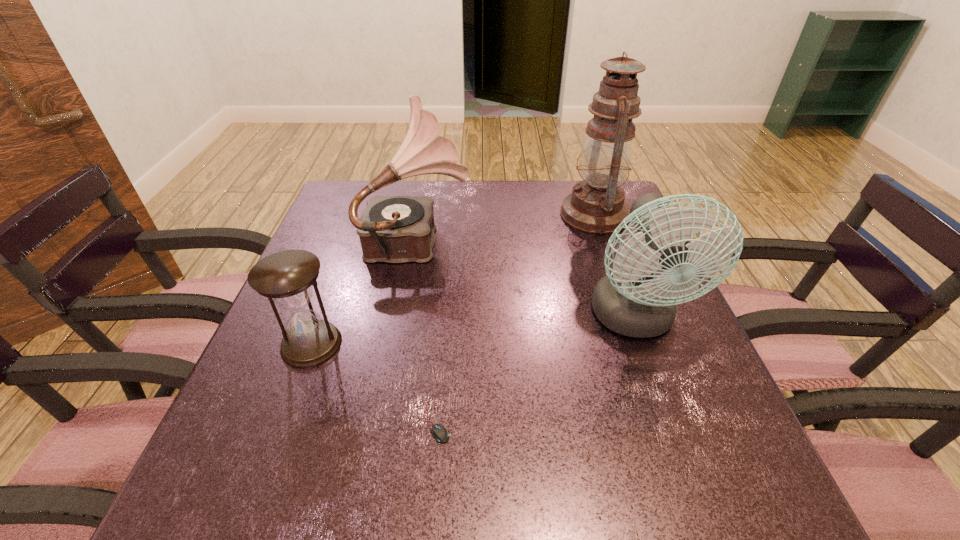
This screenshot has height=540, width=960. Find the location of `vacant space at the near edge`. vacant space at the near edge is located at coordinates (572, 484).

Where is `vacant space at the left edge of the desktop`? vacant space at the left edge of the desktop is located at coordinates (254, 447).

Image resolution: width=960 pixels, height=540 pixels. I want to click on vacant area at the right edge, so click(684, 375).

This screenshot has height=540, width=960. Find the location of `vacant space at the far left corner`. vacant space at the far left corner is located at coordinates (339, 192).

The width and height of the screenshot is (960, 540). I want to click on vacant area between the fourth tallest object and the oil lamp, so click(x=453, y=279).

Where is `vacant area that lies between the fan and the second shortest object`? The height and width of the screenshot is (540, 960). vacant area that lies between the fan and the second shortest object is located at coordinates (473, 332).

This screenshot has width=960, height=540. Find the location of `vacant space that is in between the record player and the fan`. vacant space that is in between the record player and the fan is located at coordinates (527, 279).

Where is `blank region between the hourglass and the oil lamp`? Image resolution: width=960 pixels, height=540 pixels. blank region between the hourglass and the oil lamp is located at coordinates (453, 279).

Where is `vacant area that lies between the mouse and the second shortest object`? vacant area that lies between the mouse and the second shortest object is located at coordinates (373, 383).

Where is `vacant point located between the hourglass and the record player`? The image size is (960, 540). vacant point located between the hourglass and the record player is located at coordinates [x=366, y=292].